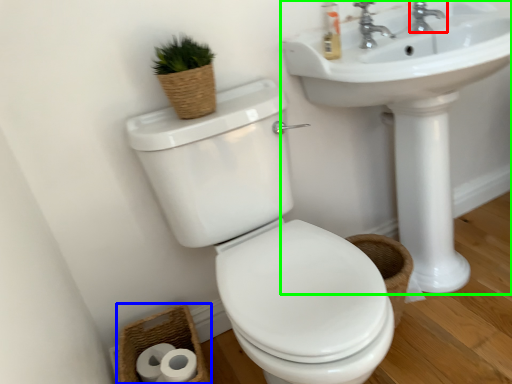
Question: Based on their relative distances, which object is farther from tap (highlighted by a red box)? Choose from basket (highlighted by a blue box) and sink (highlighted by a green box).

Choices:
 (A) basket
 (B) sink

Answer: (A)